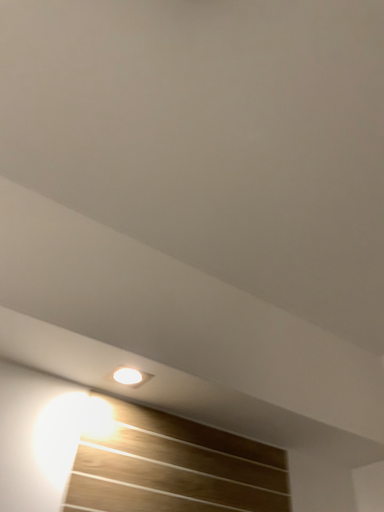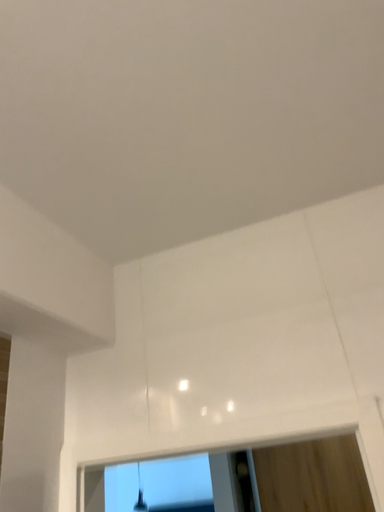
Question: Which way did the camera rotate in the video?

Choices:
 (A) rotated left
 (B) rotated right

Answer: (B)